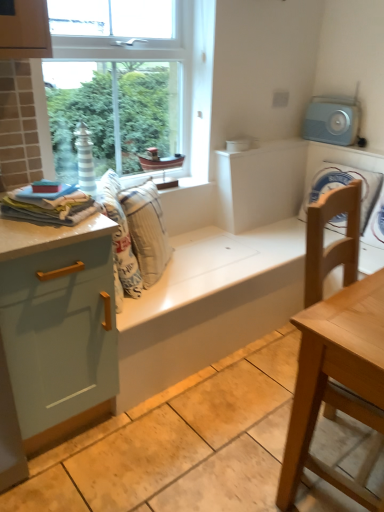
Identify the location of unoccupied space behind light wood table at right. (265, 381).